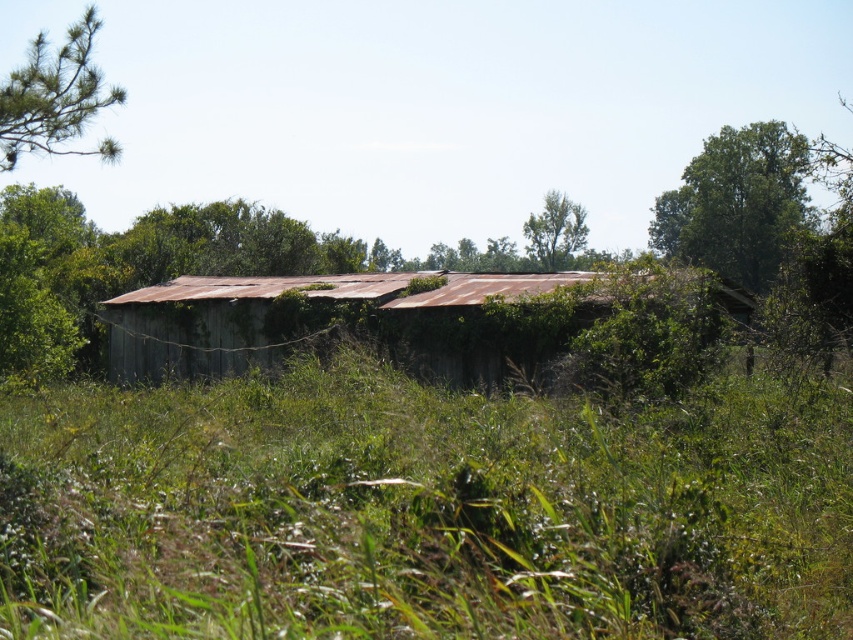
Between green matte tree at upper left and green leafy tree at upper center, which one has more height?

green matte tree at upper left is taller.

Which is behind, point (90, 106) or point (560, 260)?

Point (560, 260)

What are the coordinates of `green matte tree at upper left` in the screenshot? It's located at (55, 97).

Who is more distant from viewer, (726, 154) or (558, 260)?

Positioned behind is point (558, 260).

Can you confirm if green leafy tree at upper right is wider than green leafy tree at upper center?

Yes.

Between point (741, 188) and point (547, 208), which one is positioned behind?

Point (547, 208)

This screenshot has width=853, height=640. I want to click on green leafy tree at upper right, so click(737, 204).

In the scene shown: How much distance is there between rusty metal barn at center and green leafy tree at upper right?

They are 38.49 meters apart.

Looking at this image, which is more to the left, rusty metal barn at center or green leafy tree at upper right?

From the viewer's perspective, rusty metal barn at center appears more on the left side.

Who is more distant from viewer, (390, 301) or (784, 132)?

The point (784, 132) is more distant.

This screenshot has height=640, width=853. Identify the location of rusty metal barn at center. (350, 305).